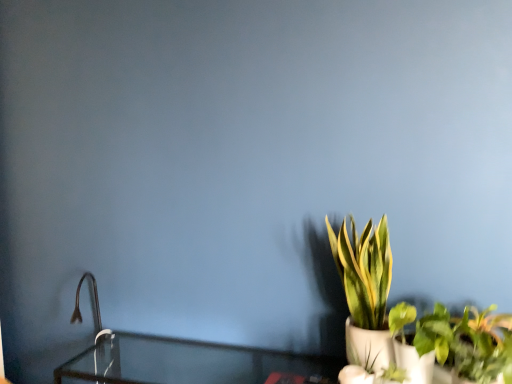
Question: Choose the correct answer: Is matte black faucet at left inside green leafy plant in white pot at right or outside it?

Choices:
 (A) outside
 (B) inside

Answer: (A)

Question: Based on their positions, is matte black faucet at left located to the left or right of green leafy plant in white pot at right?

Choices:
 (A) right
 (B) left

Answer: (B)

Question: Which is nearer to the matte black faucet at left?

Choices:
 (A) green leafy plant in white pot at right
 (B) green leafy plant at lower right

Answer: (A)

Question: Considering the real-world distances, which object is farthest from the matte black faucet at left?

Choices:
 (A) green leafy plant in white pot at right
 (B) green leafy plant at lower right

Answer: (B)